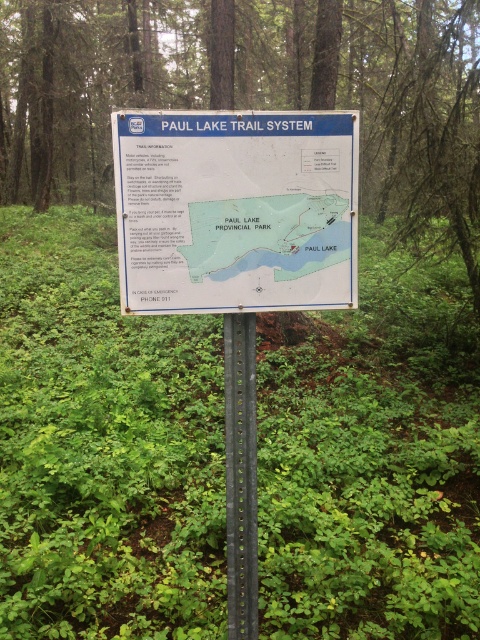
You are a hiker planning to take a photo of the white paper sign at center and the green leafy tree at center. Which object should you focus on if you want to capture both in the frame without moving the camera? Explain your reasoning based on their sizes.

The green leafy tree at center is larger than the white paper sign at center. To include both in the frame without moving the camera, focus on the green leafy tree at center since it occupies more space, allowing the smaller white paper sign at center to fit within the same field of view.

You are standing in front of the Paul Lake Trail System signboard and want to touch both points on the signboard. Which point should you reach for first, point 1 at coordinates (228,88) or point 2 at coordinates (311,266)?

You should reach for point 1 at coordinates (228,88) first because it is closer to you than point 2 at coordinates (311,266), which is further away.

You are a hiker who wants to look at the white paper map at center. Can you see the entire map without moving the black metal pole at center?

The white paper map at center is in front of black metal pole at center, so yes, you can see the entire map without moving the pole because the map is positioned in front of it and not obstructed by the pole.